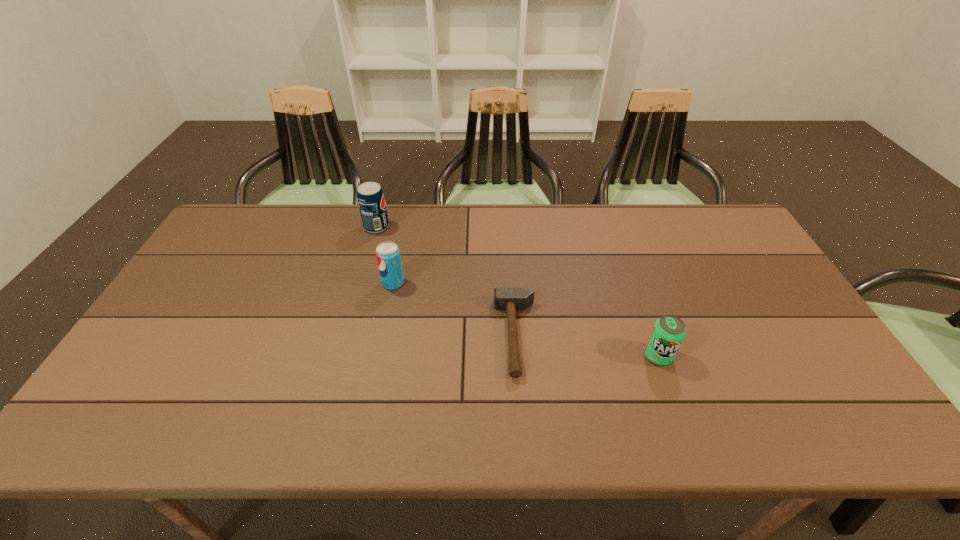
The image size is (960, 540). Find the location of `the farthest pop soda`. the farthest pop soda is located at coordinates (370, 196).

Identify the location of the leftmost pop soda. (370, 196).

Where is `the second pop soda from right to left`? the second pop soda from right to left is located at coordinates (388, 257).

At what (x,y) coordinates should I click in order to perform the action: click on the second farthest pop soda. Please return your answer as a coordinate pair (x, y). This screenshot has height=540, width=960. Looking at the image, I should click on (388, 257).

Locate an element on the screen. This screenshot has height=540, width=960. the nearest pop soda is located at coordinates pyautogui.click(x=668, y=332).

Find the location of a particular element. the rightmost object is located at coordinates (668, 332).

Where is `the third object from left to right`? This screenshot has height=540, width=960. the third object from left to right is located at coordinates [511, 299].

This screenshot has width=960, height=540. I want to click on hammer, so click(511, 299).

You are a GUI agent. You are given a task and a screenshot of the screen. Output one action in this format:
    pyautogui.click(x=<x>, y=<y>)
    Task: Click on the vacant space located on the front of the farthest object
    The width and height of the screenshot is (960, 540).
    Given the screenshot: What is the action you would take?
    371,248

Identify the location of blank space located on the left of the second farthest pop soda. This screenshot has width=960, height=540. (362, 283).